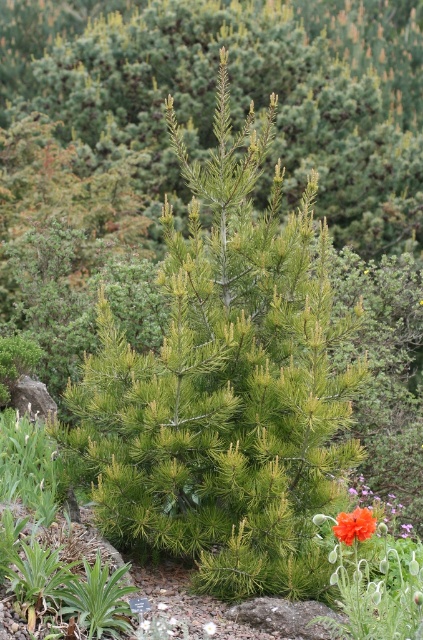
Question: Is green needle-like tree at center above white matte flower at center?

Choices:
 (A) no
 (B) yes

Answer: (B)

Question: Does green needle-like tree at center have a greater width compared to white matte flower at center?

Choices:
 (A) yes
 (B) no

Answer: (A)

Question: Is green needle-like tree at center above white matte flower at center?

Choices:
 (A) yes
 (B) no

Answer: (A)

Question: Estimate the real-world distances between objects in this image. Which object is farther from the white matte flower at center?

Choices:
 (A) orange matte flower at center
 (B) green needle-like tree at center

Answer: (B)

Question: Which object is closer to the camera taking this photo?

Choices:
 (A) green needle-like tree at center
 (B) orange matte flower at center

Answer: (B)

Question: Estimate the real-world distances between objects in this image. Which object is closer to the orange matte flower at center?

Choices:
 (A) white matte flower at center
 (B) green needle-like tree at center

Answer: (A)